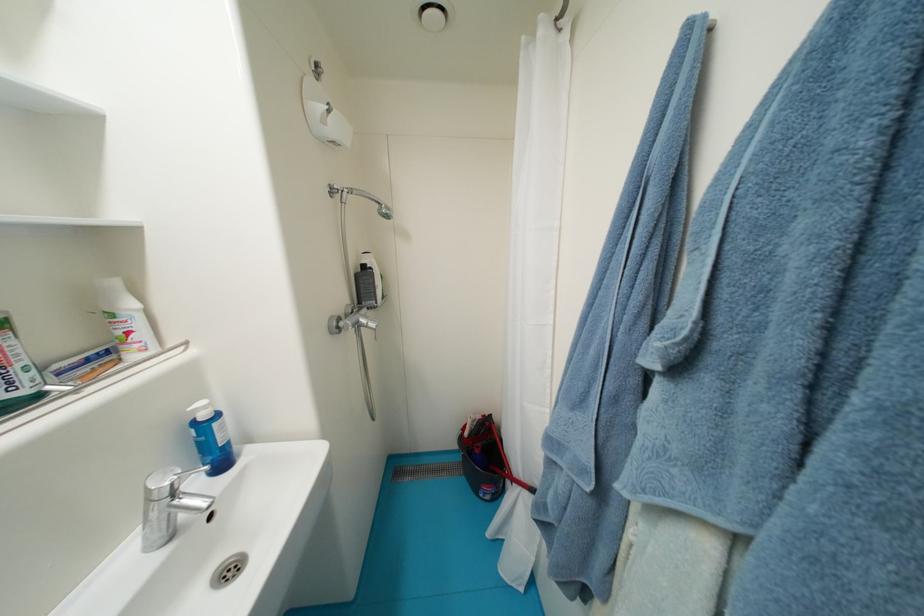
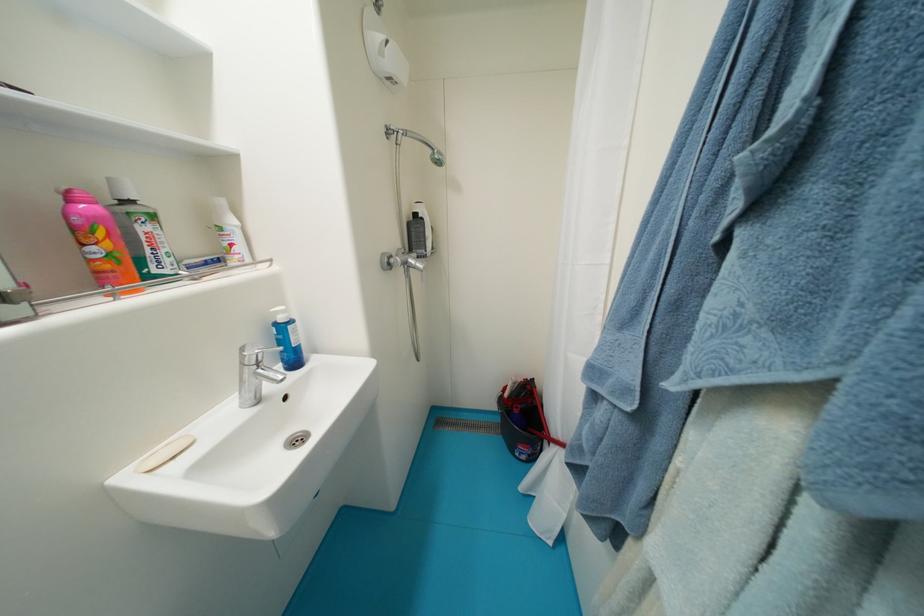
Question: The camera is either moving clockwise (left) or counter-clockwise (right) around the object. The first image is from the beginning of the video and the second image is from the end. Is the camera moving left or right when shooting the video?

Choices:
 (A) Left
 (B) Right

Answer: (B)